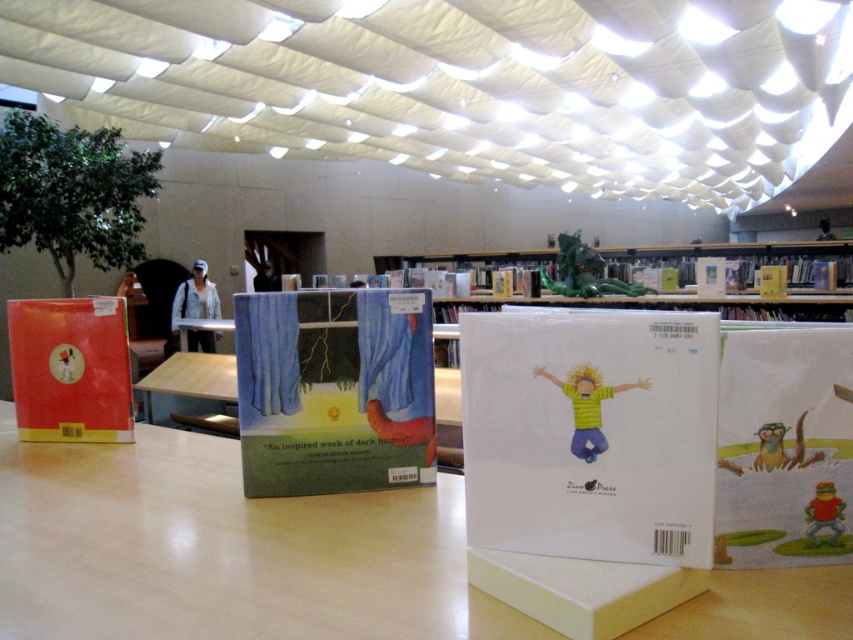
From the picture: You are organizing a children book fair and need to place a new book display. You have a light brown wooden table at center and a matte cardboard table at center. According to the scene, which table should you place the new display on if you want it to be more visible to visitors?

The light brown wooden table at center is located above the matte cardboard table at center, so placing the new display on the light brown wooden table at center would make it more visible to visitors.

You are a librarian who wants to place a new book on the shelf. You have two points marked on the wall where you can place the book. The points are point (347, 355) and point (799, 358). Which point is closer to the camera and thus a better spot for visibility?

Point (347, 355) is further to the camera than point (799, 358). Wait, the question asks for the closer one. Hmm, the description says point A is further than point B. So the closer one is point B, which is (799, 358). Therefore, the answer should be point (799, 358) is closer to the camera, so that is the better spot for visibility.

You are organizing books on a table in a library. You have a blue fabric book at center and a matte paper book at center. If you want to place a new book in front of both of them, where should you place it?

The new book should be placed in front of the blue fabric book at center since it is in front of the matte paper book at center, which is behind it.